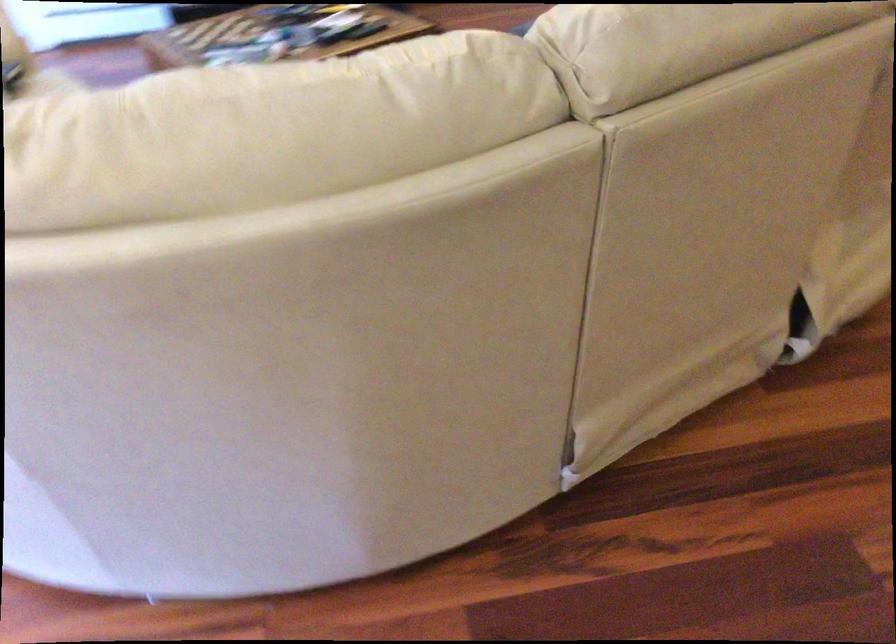
The height and width of the screenshot is (644, 896). What do you see at coordinates (47, 82) in the screenshot?
I see `a sofa sitting surface` at bounding box center [47, 82].